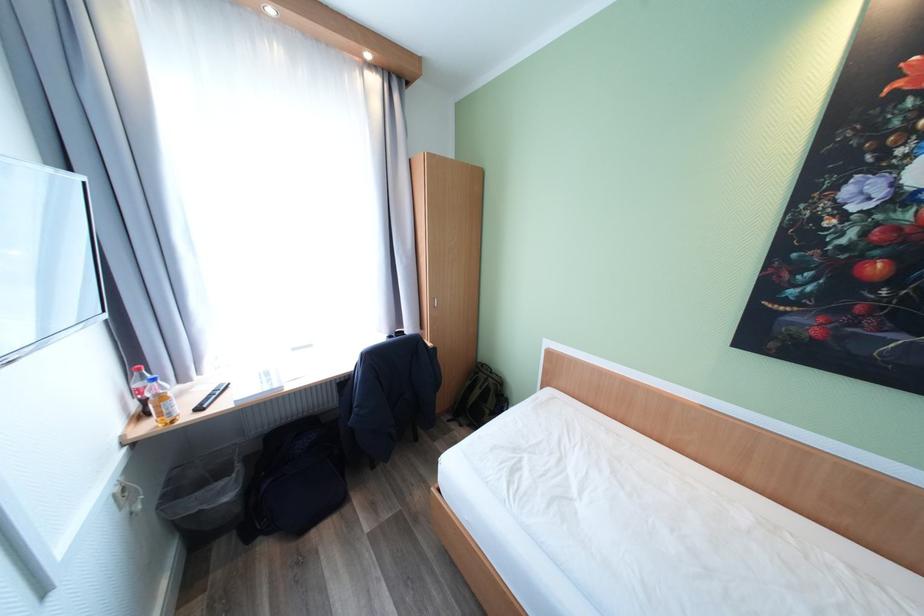
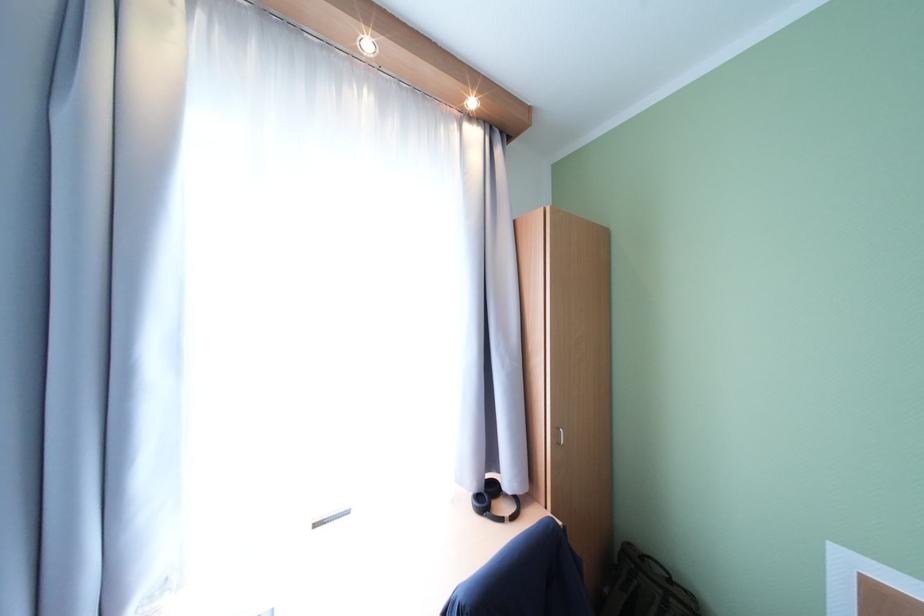
Question: The images are taken continuously from a first-person perspective. In which direction is your viewpoint rotating?

Choices:
 (A) Left
 (B) Right
 (C) Up
 (D) Down

Answer: (C)